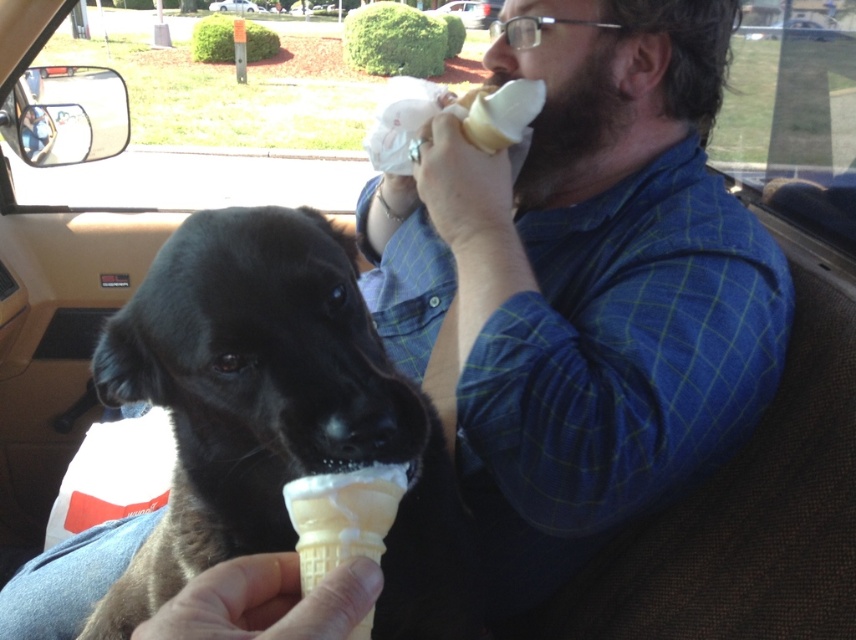
Question: Can you confirm if vanilla waffle cone at center is positioned above metallic silver car at upper center?

Choices:
 (A) no
 (B) yes

Answer: (A)

Question: Can you confirm if vanilla waffle cone at center is wider than white plastic bag at center?

Choices:
 (A) yes
 (B) no

Answer: (B)

Question: Is black fur dog at center to the right of white plastic bag at center from the viewer's perspective?

Choices:
 (A) no
 (B) yes

Answer: (B)

Question: Which of the following is the farthest from the observer?

Choices:
 (A) vanilla waffle cone at center
 (B) black fur dog at center

Answer: (B)

Question: Which point is farther to the camera?

Choices:
 (A) [367, 336]
 (B) [480, 19]
 (C) [247, 10]
 (D) [372, 548]

Answer: (C)

Question: Which of the following is the closest to the observer?

Choices:
 (A) black fur dog at center
 (B) white plastic bag at center
 (C) vanilla waffle cone at center

Answer: (C)